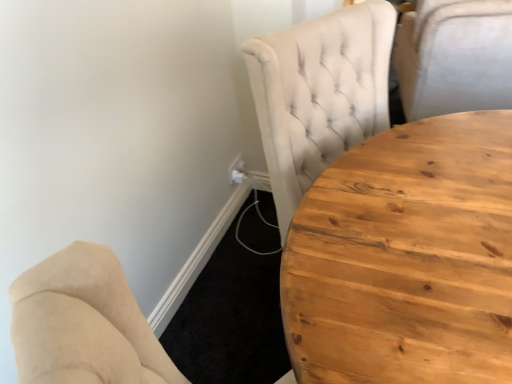
Locate an element on the screen. wooden table at center is located at coordinates (x=406, y=258).

Image resolution: width=512 pixels, height=384 pixels. What do you see at coordinates (406, 258) in the screenshot? I see `wooden table at center` at bounding box center [406, 258].

What are the coordinates of `wooden table at center` in the screenshot? It's located at (406, 258).